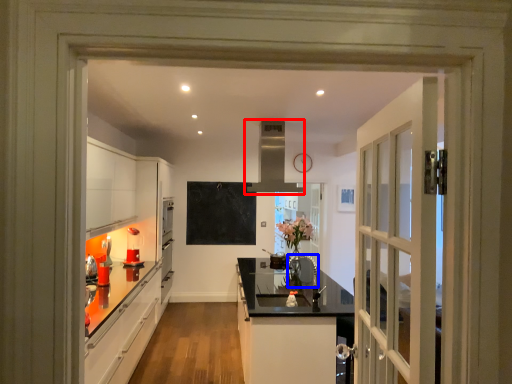
Question: Which point is closer to the camera, exhaust hood (highlighted by a red box) or appliance (highlighted by a blue box)?

Choices:
 (A) exhaust hood
 (B) appliance

Answer: (B)